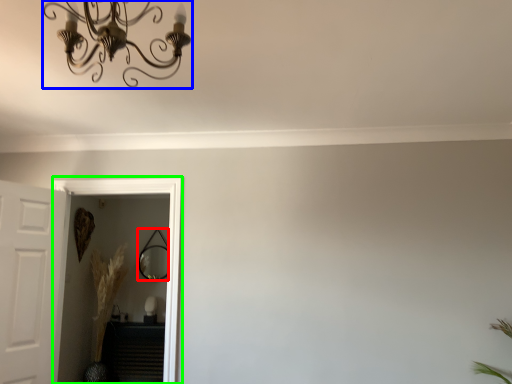
Question: Estimate the real-world distances between objects in this image. Which object is farther from mirror (highlighted by a red box), light fixture (highlighted by a blue box) or glass door (highlighted by a green box)?

Choices:
 (A) light fixture
 (B) glass door

Answer: (A)